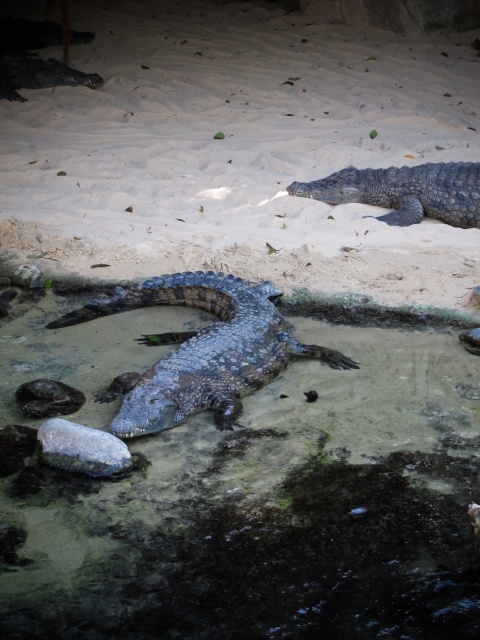
You are standing in front of the enclosure and want to take a photo of the shiny gray crocodile at center. If your camera has a maximum focus range of 10 feet, will you need to move closer to get a clear shot?

The shiny gray crocodile at center is 12.12 feet away from you. Since your camera can only focus up to 10 feet, you need to move closer to ensure the image is in focus.

You are a zookeeper observing the crocodiles in their enclosure. You notice a specific point marked at coordinates (244, 492). Based on the scene description, what is located at this point?

The point at coordinates (244, 492) marks sandy textured mud at center.